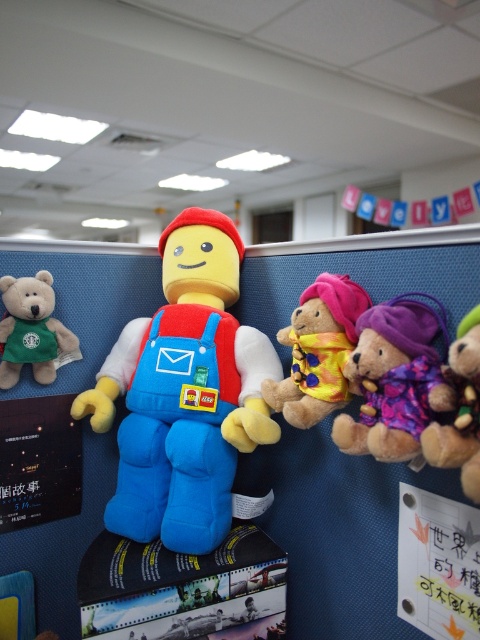
You are an office worker who wants to hang a new photo frame between the soft plush toy at center and the fluffy yellow teddy bear at center on the cubicle wall. Based on their positions, where should you place the photo frame?

The soft plush toy at center is located below the fluffy yellow teddy bear at center, so the photo frame should be placed between them vertically, above the soft plush toy at center and below the fluffy yellow teddy bear at center.

You are standing in front of the office cubicle wall with the plush toys. There are two points marked on the wall at coordinates point (224, 444) and point (411, 380). If you want to place a new sticker closer to the camera, which point should you choose?

You should choose point (224, 444) because it is further to the camera than point (411, 380).